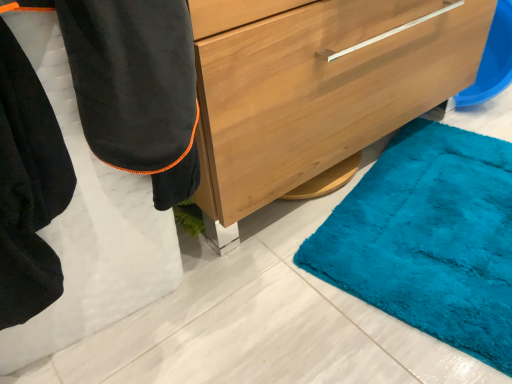
Question: Are black fleece robe at lower left and wooden chest of drawers at center located far from each other?

Choices:
 (A) yes
 (B) no

Answer: (B)

Question: Is black fleece robe at lower left oriented towards wooden chest of drawers at center?

Choices:
 (A) no
 (B) yes

Answer: (A)

Question: Is black fleece robe at lower left in contact with wooden chest of drawers at center?

Choices:
 (A) yes
 (B) no

Answer: (B)

Question: Is black fleece robe at lower left taller than wooden chest of drawers at center?

Choices:
 (A) no
 (B) yes

Answer: (B)

Question: From the image's perspective, would you say black fleece robe at lower left is shown under wooden chest of drawers at center?

Choices:
 (A) yes
 (B) no

Answer: (A)

Question: Is black fleece robe at lower left positioned with its back to wooden chest of drawers at center?

Choices:
 (A) no
 (B) yes

Answer: (A)

Question: Is wooden chest of drawers at center smaller than black fleece robe at lower left?

Choices:
 (A) no
 (B) yes

Answer: (A)

Question: From a real-world perspective, is wooden chest of drawers at center on top of black fleece robe at lower left?

Choices:
 (A) no
 (B) yes

Answer: (A)

Question: Is wooden chest of drawers at center located outside black fleece robe at lower left?

Choices:
 (A) no
 (B) yes

Answer: (B)

Question: Is wooden chest of drawers at center far away from black fleece robe at lower left?

Choices:
 (A) no
 (B) yes

Answer: (A)

Question: From a real-world perspective, is wooden chest of drawers at center physically below black fleece robe at lower left?

Choices:
 (A) yes
 (B) no

Answer: (A)

Question: Is wooden chest of drawers at center bigger than black fleece robe at lower left?

Choices:
 (A) no
 (B) yes

Answer: (B)

Question: In terms of height, does black fleece robe at lower left look taller or shorter compared to wooden chest of drawers at center?

Choices:
 (A) short
 (B) tall

Answer: (B)